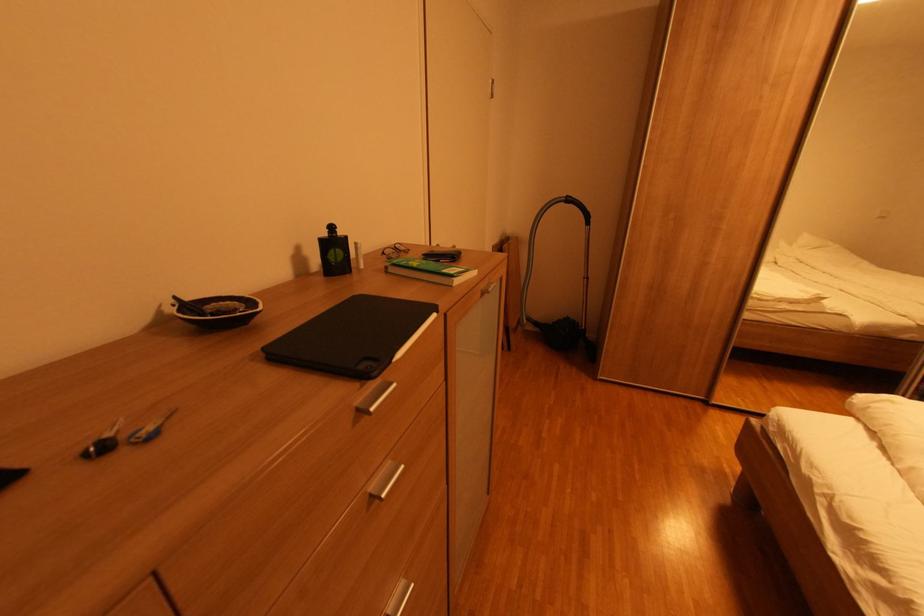
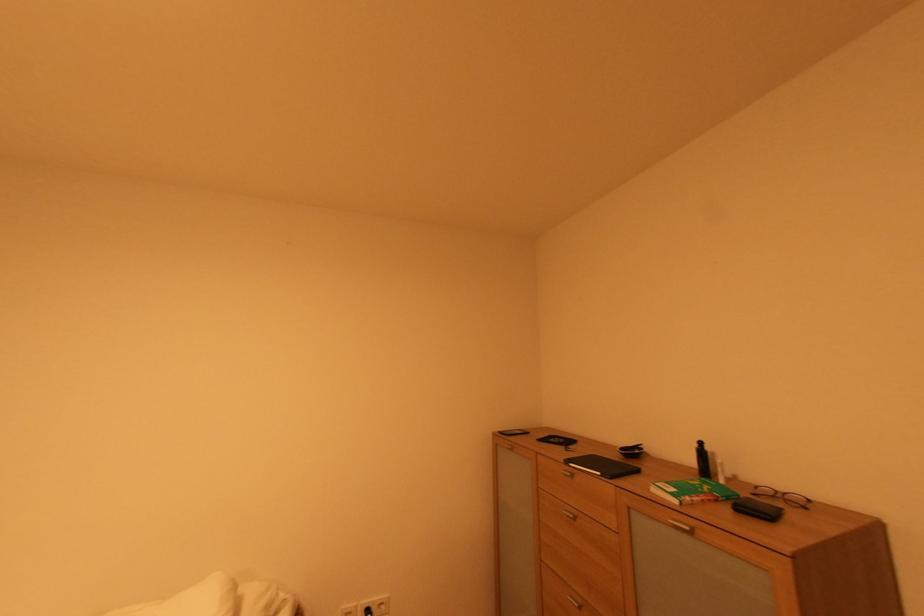
The point at (x=441, y=315) is marked in the first image. Where is the corresponding point in the second image?

(604, 475)